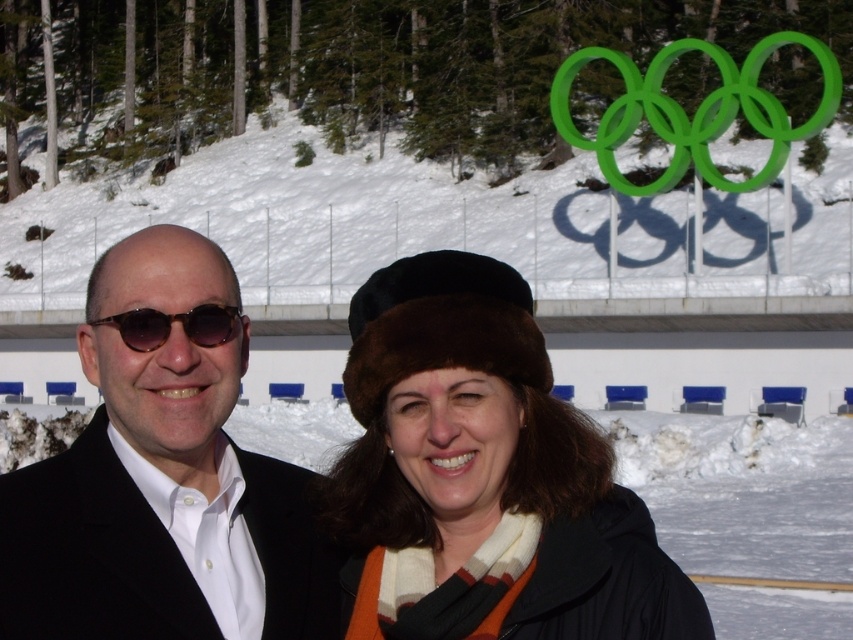
You are a photographer at the winter venue. You need to adjust the focus of your camera to capture the black matte suit at left and the tortoiseshell plastic sunglasses at left. Which object should you focus on first to ensure both are in sharp focus?

The black matte suit at left is closer to the viewer than the tortoiseshell plastic sunglasses at left, so focus on the black matte suit at left first to ensure both are in sharp focus.

You are an event photographer at the Winter Olympics. You need to capture a photo of the brown fur hat at center and the black matte suit at left. Which object should you zoom in on to focus on the smaller one?

The brown fur hat at center has a smaller size compared to the black matte suit at left, so you should zoom in on the brown fur hat at center to focus on the smaller one.